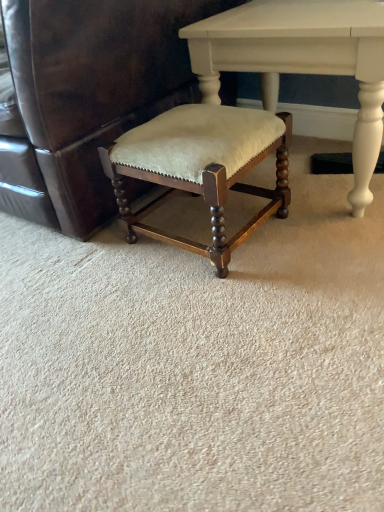
Find the location of a particular element. vacant area that lies in front of matte white table at center is located at coordinates (301, 270).